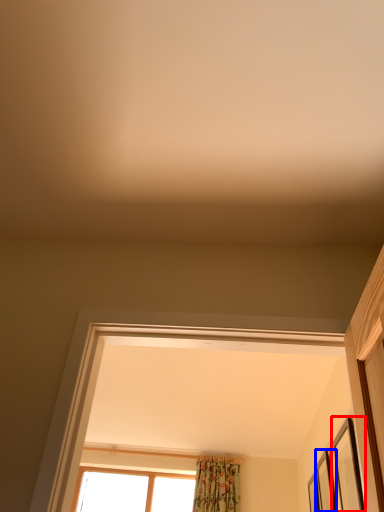
Question: Among these objects, which one is nearest to the camera, picture frame (highlighted by a red box) or picture frame (highlighted by a blue box)?

Choices:
 (A) picture frame
 (B) picture frame

Answer: (A)